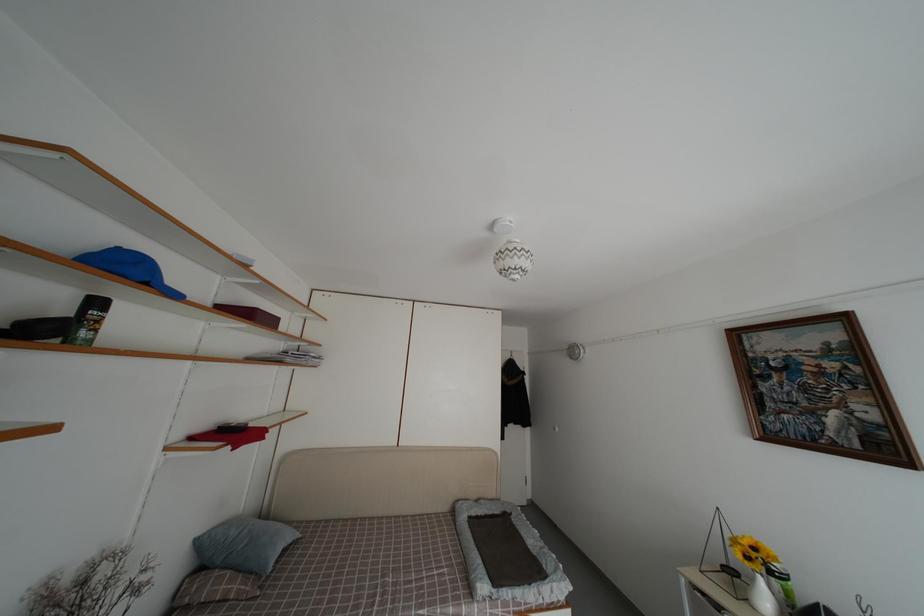
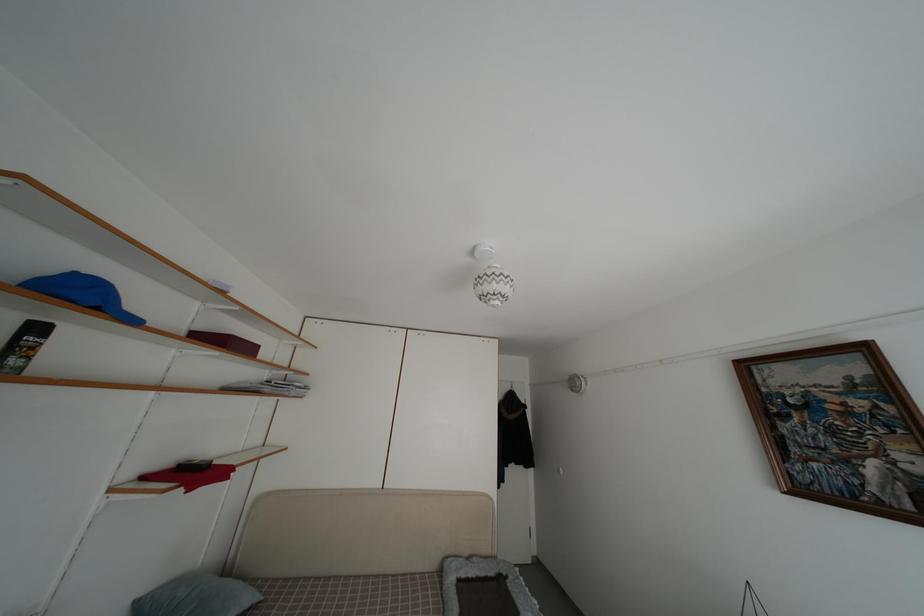
Locate, in the second image, the point that corresponds to (x=202, y=546) in the first image.

(142, 610)